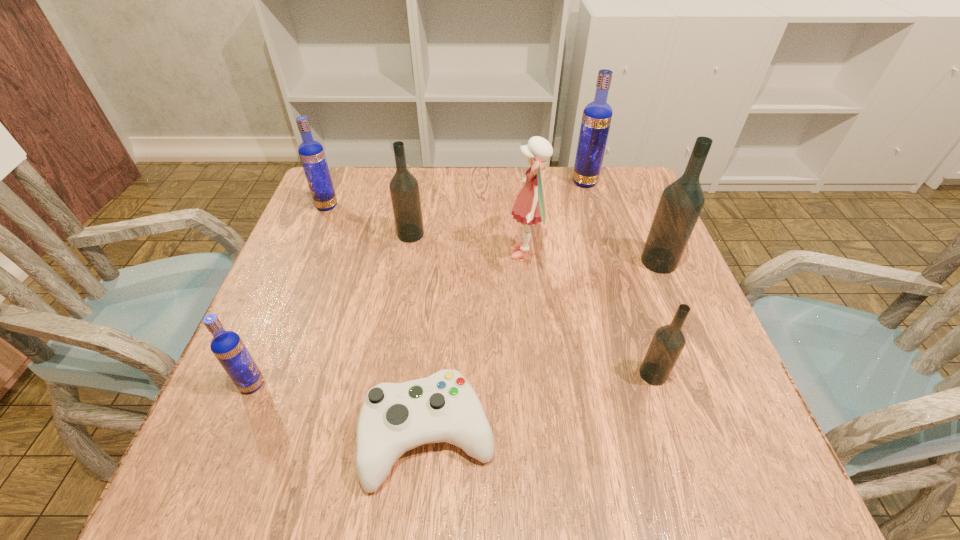
Locate an element on the screen. unoccupied area between the rightmost blue vodka and the nearest blue vodka is located at coordinates (419, 284).

Where is `free area in between the fourth object from right to left and the second biggest blue vodka`? The width and height of the screenshot is (960, 540). free area in between the fourth object from right to left and the second biggest blue vodka is located at coordinates (426, 230).

Locate an element on the screen. The image size is (960, 540). empty space that is in between the second black vodka from right to left and the fifth object from left to right is located at coordinates (589, 314).

The image size is (960, 540). I want to click on empty location between the rightmost black vodka and the leftmost black vodka, so click(x=535, y=248).

Where is `the second closest object to the smallest black vodka`? This screenshot has height=540, width=960. the second closest object to the smallest black vodka is located at coordinates [530, 207].

This screenshot has height=540, width=960. I want to click on the seventh closest object to the nearest blue vodka, so pos(596,119).

Identify which vodka is the second nearest to the farthest vodka. Please provide its 2D coordinates. Your answer should be formatted as a tuple, i.e. [(x, y)], where the tuple contains the x and y coordinates of a point satisfying the conditions above.

[(404, 189)]

The width and height of the screenshot is (960, 540). I want to click on vodka that is the fourth closest to the doll, so click(x=669, y=340).

Find the location of `blue vodka that stands as the third closest to the leftmost black vodka`. blue vodka that stands as the third closest to the leftmost black vodka is located at coordinates (596, 119).

Locate an element on the screen. The height and width of the screenshot is (540, 960). the second closest blue vodka to the shortest object is located at coordinates (311, 153).